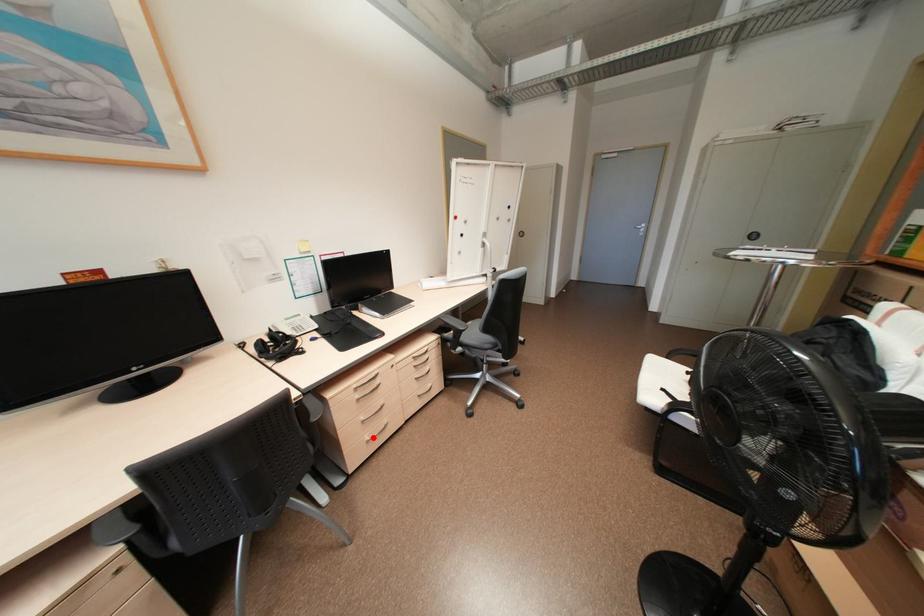
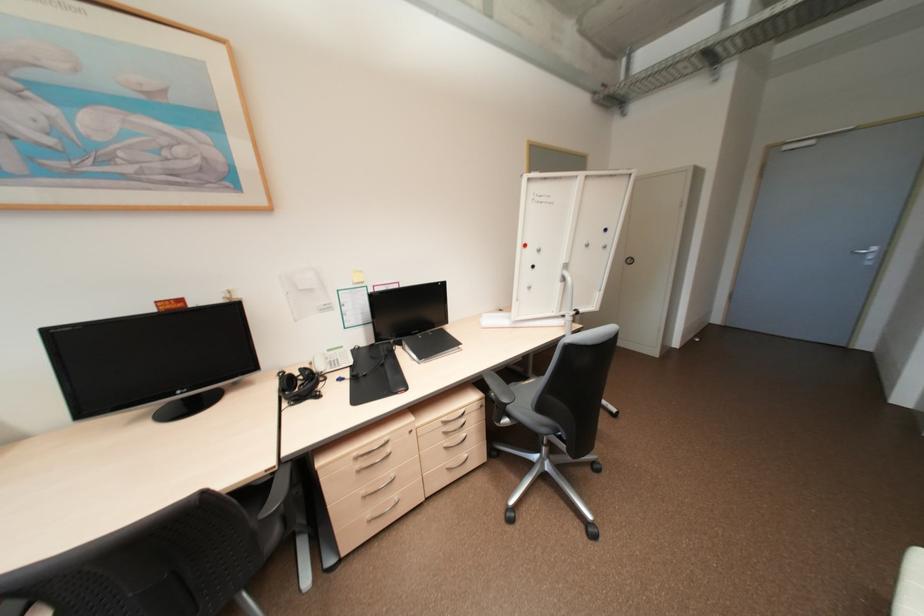
Question: I am providing you with two images of the same scene from different viewpoints. Given a red point in image1, look at the same physical point in image2. Is it:

Choices:
 (A) Closer to the viewpoint
 (B) Farther from the viewpoint

Answer: (B)